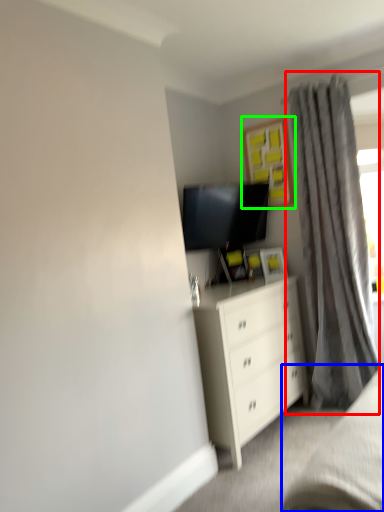
Question: Which object is positioned closest to curtain (highlighted by a red box)? Select from bed frame (highlighted by a blue box) and picture frame (highlighted by a green box).

Choices:
 (A) bed frame
 (B) picture frame

Answer: (B)